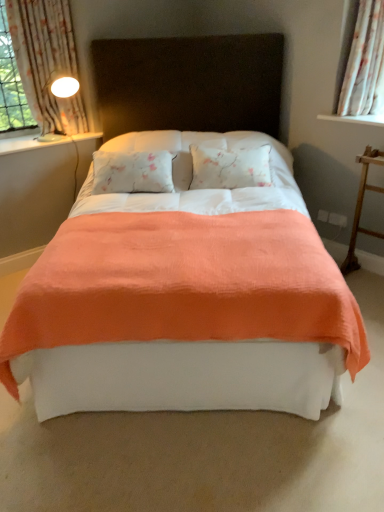
Question: Is white floral fabric curtain at upper right, which is the first curtain in right-to-left order, not inside coral fabric bed at center?

Choices:
 (A) no
 (B) yes

Answer: (B)

Question: Does white floral fabric curtain at upper right, which is the second curtain from left to right, have a smaller size compared to coral fabric bed at center?

Choices:
 (A) no
 (B) yes

Answer: (B)

Question: Considering the relative sizes of white floral fabric curtain at upper right, which is the first curtain in right-to-left order, and coral fabric bed at center in the image provided, is white floral fabric curtain at upper right, which is the first curtain in right-to-left order, taller than coral fabric bed at center?

Choices:
 (A) yes
 (B) no

Answer: (B)

Question: Would you consider white floral fabric curtain at upper right, which is the second curtain from left to right, to be distant from coral fabric bed at center?

Choices:
 (A) no
 (B) yes

Answer: (B)

Question: Is the position of white floral fabric curtain at upper right, which is the first curtain in right-to-left order, less distant than that of coral fabric bed at center?

Choices:
 (A) yes
 (B) no

Answer: (B)

Question: Does white floral fabric curtain at upper right, which is the first curtain in right-to-left order, contain coral fabric bed at center?

Choices:
 (A) no
 (B) yes

Answer: (A)

Question: Does wooden ladder at right come in front of floral fabric curtain at left, which is counted as the second curtain, starting from the right?

Choices:
 (A) no
 (B) yes

Answer: (B)

Question: Can we say wooden ladder at right lies outside floral fabric curtain at left, which is counted as the first curtain, starting from the left?

Choices:
 (A) yes
 (B) no

Answer: (A)

Question: Considering the relative sizes of wooden ladder at right and floral fabric curtain at left, which is counted as the second curtain, starting from the right, in the image provided, is wooden ladder at right thinner than floral fabric curtain at left, which is counted as the second curtain, starting from the right,?

Choices:
 (A) no
 (B) yes

Answer: (A)

Question: Is wooden ladder at right facing towards floral fabric curtain at left, which is counted as the second curtain, starting from the right?

Choices:
 (A) yes
 (B) no

Answer: (B)

Question: Is wooden ladder at right taller than floral fabric curtain at left, which is counted as the first curtain, starting from the left?

Choices:
 (A) yes
 (B) no

Answer: (B)

Question: Is wooden ladder at right further to camera compared to floral fabric curtain at left, which is counted as the first curtain, starting from the left?

Choices:
 (A) yes
 (B) no

Answer: (B)

Question: Is floral fabric curtain at left, which is counted as the first curtain, starting from the left, oriented away from wooden ladder at right?

Choices:
 (A) yes
 (B) no

Answer: (B)